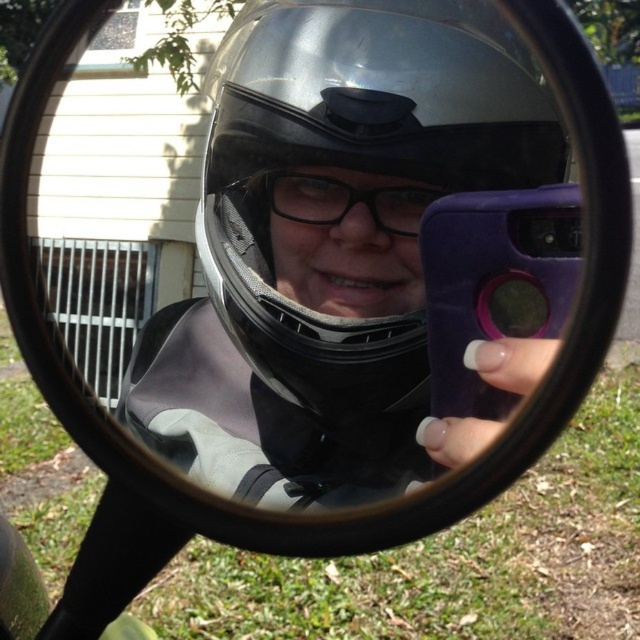
Question: Is transparent matte helmet at center to the left of black matte glasses at center from the viewer's perspective?

Choices:
 (A) no
 (B) yes

Answer: (B)

Question: Is transparent matte helmet at center to the left of black matte glasses at center from the viewer's perspective?

Choices:
 (A) no
 (B) yes

Answer: (B)

Question: From the image, what is the correct spatial relationship of transparent matte helmet at center in relation to black matte glasses at center?

Choices:
 (A) below
 (B) above

Answer: (B)

Question: Among these points, which one is farthest from the camera?

Choices:
 (A) (404, 227)
 (B) (397, 392)

Answer: (B)

Question: Which object appears closest to the camera in this image?

Choices:
 (A) black matte glasses at center
 (B) transparent matte helmet at center

Answer: (B)